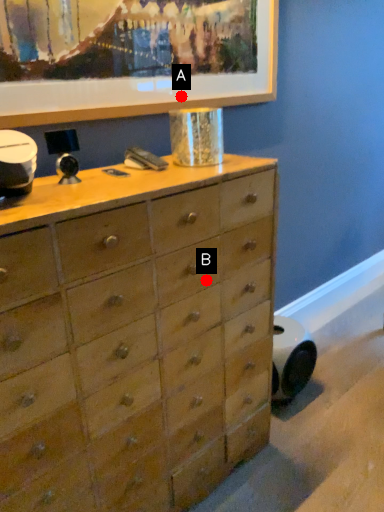
Question: Two points are circled on the image, labeled by A and B beside each circle. Which point is further to the camera?

Choices:
 (A) A is further
 (B) B is further

Answer: (A)